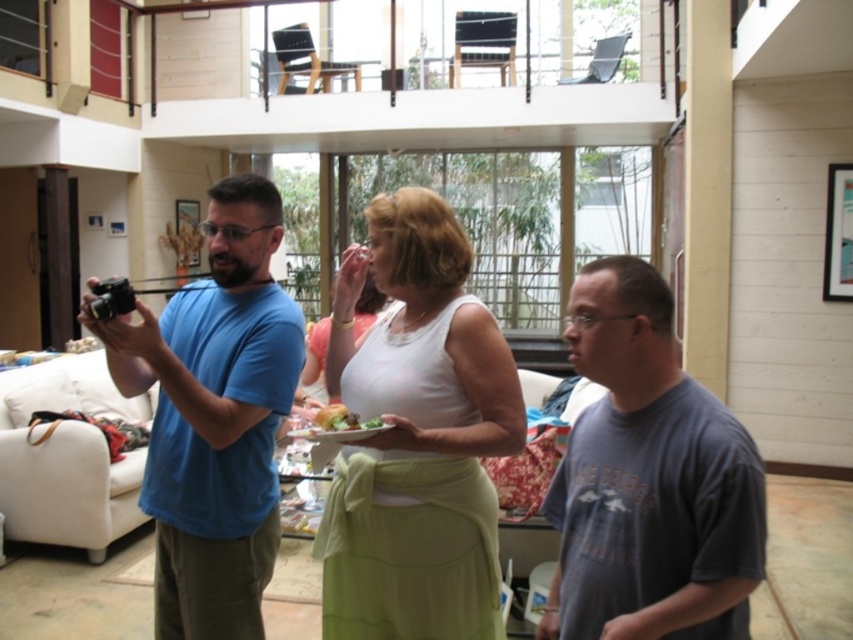
Question: Among these objects, which one is nearest to the camera?

Choices:
 (A) green matte plate at center
 (B) white matte tank top at center
 (C) blue cotton shirt at left
 (D) green leafy salad at center

Answer: (B)

Question: Which point is closer to the camera?

Choices:
 (A) (351, 428)
 (B) (447, 225)
 (C) (685, 474)

Answer: (C)

Question: Does white matte tank top at center appear on the left side of gray cotton t-shirt at center?

Choices:
 (A) yes
 (B) no

Answer: (A)

Question: Is gray cotton t-shirt at center in front of green matte plate at center?

Choices:
 (A) no
 (B) yes

Answer: (B)

Question: Can you confirm if gray cotton t-shirt at center is smaller than green matte plate at center?

Choices:
 (A) yes
 (B) no

Answer: (B)

Question: Which object is farther from the camera taking this photo?

Choices:
 (A) white matte tank top at center
 (B) gray cotton t-shirt at center

Answer: (A)